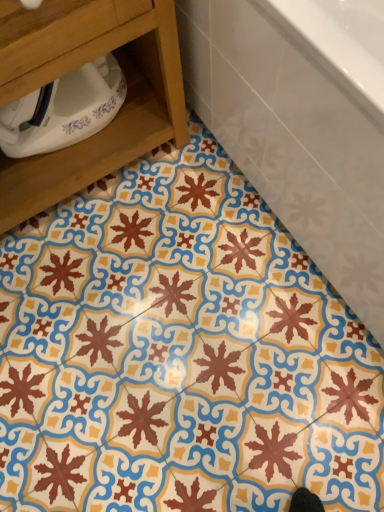
Describe the element at coordinates (293, 140) in the screenshot. I see `white glossy bathtub at upper right` at that location.

At what (x,y) coordinates should I click in order to perform the action: click on white glossy bathtub at upper right. Please return your answer as a coordinate pair (x, y). Image resolution: width=384 pixels, height=512 pixels. Looking at the image, I should click on (293, 140).

What do you see at coordinates (80, 65) in the screenshot?
I see `wooden drawer at lower left` at bounding box center [80, 65].

What is the approximate height of wooden drawer at lower left?

wooden drawer at lower left is 25.78 inches tall.

The image size is (384, 512). Identify the location of wooden drawer at lower left. (80, 65).

The height and width of the screenshot is (512, 384). I want to click on white glossy bathtub at upper right, so click(293, 140).

Is wooden drawer at lower left at the right side of white glossy bathtub at upper right?

In fact, wooden drawer at lower left is to the left of white glossy bathtub at upper right.

Considering the positions of objects wooden drawer at lower left and white glossy bathtub at upper right in the image provided, who is behind, wooden drawer at lower left or white glossy bathtub at upper right?

wooden drawer at lower left is further away from the camera.

Is point (5, 26) in front of point (236, 129)?

That is True.

From the image's perspective, relative to white glossy bathtub at upper right, is wooden drawer at lower left above or below?

wooden drawer at lower left is situated lower than white glossy bathtub at upper right in the image.

From a real-world perspective, between wooden drawer at lower left and white glossy bathtub at upper right, who is vertically lower?

white glossy bathtub at upper right is physically lower.

In the scene shown: Between wooden drawer at lower left and white glossy bathtub at upper right, which one has larger width?

With larger width is white glossy bathtub at upper right.

Between wooden drawer at lower left and white glossy bathtub at upper right, which one has more height?

wooden drawer at lower left.

Between wooden drawer at lower left and white glossy bathtub at upper right, which one has smaller size?

wooden drawer at lower left.

Would you say white glossy bathtub at upper right is part of wooden drawer at lower left's contents?

Definitely not — white glossy bathtub at upper right is not inside wooden drawer at lower left.

Is wooden drawer at lower left far from white glossy bathtub at upper right?

No, there isn't a large distance between wooden drawer at lower left and white glossy bathtub at upper right.

Could you tell me if wooden drawer at lower left is facing white glossy bathtub at upper right?

No, wooden drawer at lower left is not facing towards white glossy bathtub at upper right.

How distant is wooden drawer at lower left from white glossy bathtub at upper right?

wooden drawer at lower left is 11.28 inches away from white glossy bathtub at upper right.

Identify the location of furniture on the left side of white glossy bathtub at upper right. (80, 65).

Based on their positions, is white glossy bathtub at upper right located to the left or right of wooden drawer at lower left?

white glossy bathtub at upper right is positioned on wooden drawer at lower left's right side.

Which is in front, white glossy bathtub at upper right or wooden drawer at lower left?

Result: Positioned in front is white glossy bathtub at upper right.

Considering the points (182, 48) and (135, 84), which point is behind, point (182, 48) or point (135, 84)?

The point (135, 84) is farther from the camera.

From the image's perspective, between white glossy bathtub at upper right and wooden drawer at lower left, who is located below?

wooden drawer at lower left is shown below in the image.

From a real-world perspective, is white glossy bathtub at upper right on wooden drawer at lower left?

No, from a real-world perspective, white glossy bathtub at upper right is not over wooden drawer at lower left

Considering the relative sizes of white glossy bathtub at upper right and wooden drawer at lower left in the image provided, is white glossy bathtub at upper right wider than wooden drawer at lower left?

Indeed, white glossy bathtub at upper right has a greater width compared to wooden drawer at lower left.

Can you confirm if white glossy bathtub at upper right is taller than wooden drawer at lower left?

No, white glossy bathtub at upper right is not taller than wooden drawer at lower left.

Can you confirm if white glossy bathtub at upper right is bigger than wooden drawer at lower left?

Indeed, white glossy bathtub at upper right has a larger size compared to wooden drawer at lower left.

Is white glossy bathtub at upper right inside the boundaries of wooden drawer at lower left, or outside?

white glossy bathtub at upper right lies outside wooden drawer at lower left.

Are white glossy bathtub at upper right and wooden drawer at lower left making contact?

white glossy bathtub at upper right is not next to wooden drawer at lower left, and they're not touching.

Is white glossy bathtub at upper right turned away from wooden drawer at lower left?

That's not correct — white glossy bathtub at upper right is not looking away from wooden drawer at lower left.

What's the angular difference between white glossy bathtub at upper right and wooden drawer at lower left's facing directions?

90.3 degrees.

I want to click on bathtub below the wooden drawer at lower left (from a real-world perspective), so click(293, 140).

Identify the location of bathtub in front of the wooden drawer at lower left. Image resolution: width=384 pixels, height=512 pixels. (293, 140).

The width and height of the screenshot is (384, 512). Identify the location of bathtub above the wooden drawer at lower left (from the image's perspective). (293, 140).